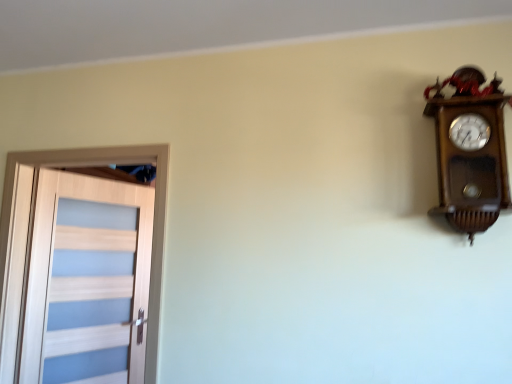
Question: From the image's perspective, is wooden wall clock at upper right located above or below light wood door at left?

Choices:
 (A) above
 (B) below

Answer: (A)

Question: From their relative heights in the image, would you say wooden wall clock at upper right is taller or shorter than light wood door at left?

Choices:
 (A) tall
 (B) short

Answer: (B)

Question: Is wooden wall clock at upper right in front of or behind light wood door at left in the image?

Choices:
 (A) front
 (B) behind

Answer: (A)

Question: Is point (94, 274) closer or farther from the camera than point (450, 187)?

Choices:
 (A) closer
 (B) farther

Answer: (B)

Question: Which is correct: light wood door at left is inside wooden wall clock at upper right, or outside of it?

Choices:
 (A) inside
 (B) outside

Answer: (B)

Question: Considering the positions of light wood door at left and wooden wall clock at upper right in the image, is light wood door at left bigger or smaller than wooden wall clock at upper right?

Choices:
 (A) small
 (B) big

Answer: (B)

Question: Considering the relative positions of light wood door at left and wooden wall clock at upper right in the image provided, is light wood door at left to the left or to the right of wooden wall clock at upper right?

Choices:
 (A) left
 (B) right

Answer: (A)